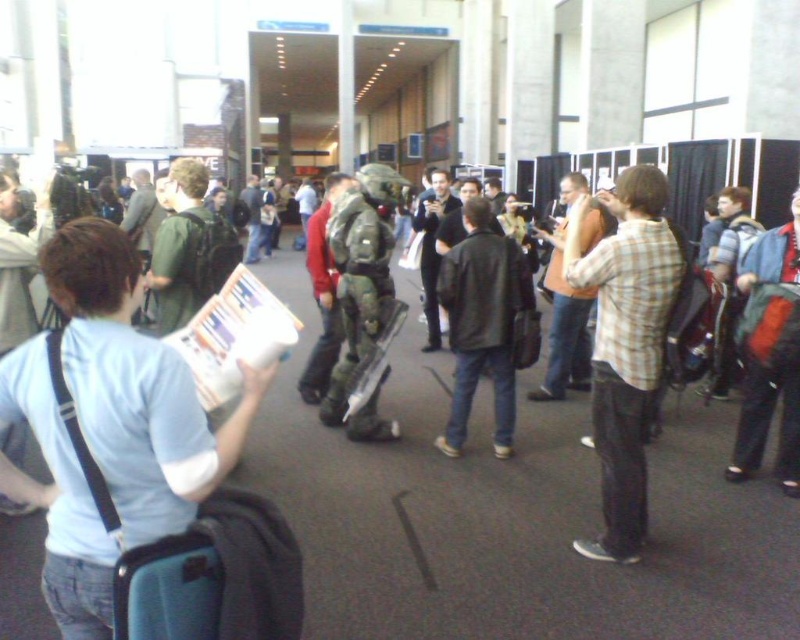
You are standing at the center of the convention hall and notice a leather jacket displayed at point (482, 323). If you want to move towards it, which direction should you walk?

Since the leather jacket at center is located at point (482, 323), you should walk straight ahead as it is directly in front of you.

From the picture: You are organizing a coat rack at the event. You have a leather jacket at center and a blue backpack at right. Which item requires more space on the coat rack?

The leather jacket at center requires more space on the coat rack because it is bigger than the blue backpack at right.